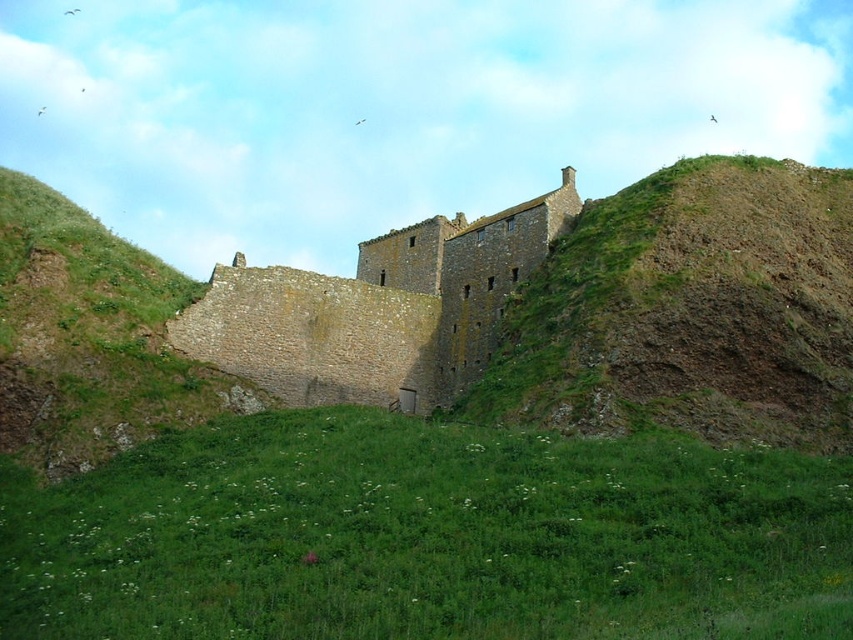
Question: Is green grassy field at center smaller than brown rocky hillside at upper right?

Choices:
 (A) no
 (B) yes

Answer: (B)

Question: Does green grassy field at center come behind brown rocky hillside at upper right?

Choices:
 (A) yes
 (B) no

Answer: (B)

Question: Does brown rocky hillside at upper right have a smaller size compared to brown stone castle at center?

Choices:
 (A) yes
 (B) no

Answer: (A)

Question: Which object appears farthest from the camera in this image?

Choices:
 (A) brown rocky hillside at upper right
 (B) green grassy field at center

Answer: (A)

Question: Which object appears closest to the camera in this image?

Choices:
 (A) brown stone castle at center
 (B) green grassy field at center

Answer: (B)

Question: Estimate the real-world distances between objects in this image. Which object is closer to the green grassy field at center?

Choices:
 (A) brown rocky hillside at upper right
 (B) brown stone castle at center

Answer: (A)